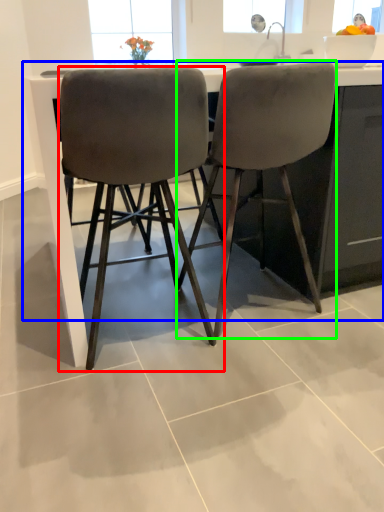
Question: Estimate the real-world distances between objects in this image. Which object is farther from chair (highlighted by a red box), counter (highlighted by a blue box) or chair (highlighted by a green box)?

Choices:
 (A) counter
 (B) chair

Answer: (B)